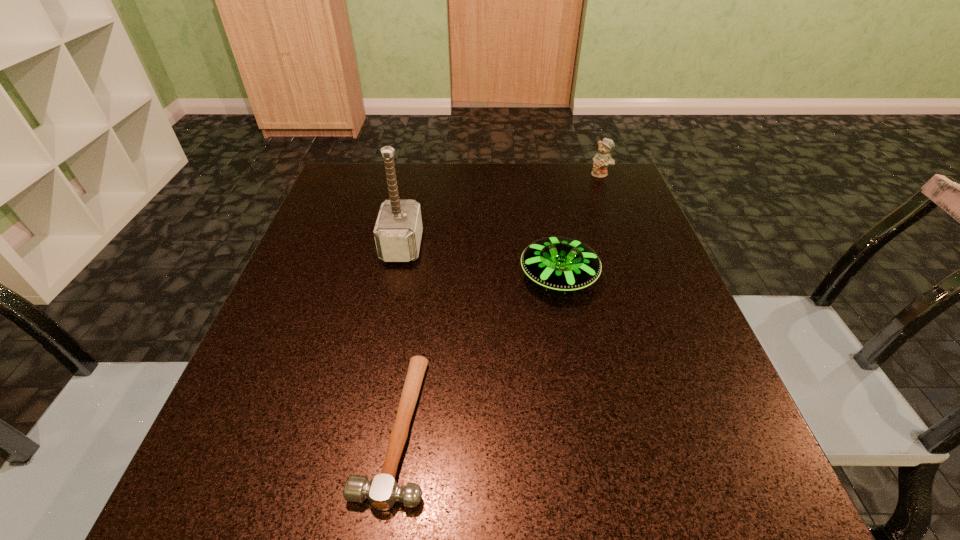
At what (x,y) coordinates should I click in order to perform the action: click on the tallest object. Please return your answer as a coordinate pair (x, y). This screenshot has height=540, width=960. Looking at the image, I should click on (398, 230).

Identify the location of the taller hammer. Image resolution: width=960 pixels, height=540 pixels. (398, 230).

Where is `the second tallest object`? the second tallest object is located at coordinates (601, 160).

Identify the location of the farthest object. (601, 160).

This screenshot has width=960, height=540. Find the location of `saucer`. saucer is located at coordinates (x=559, y=263).

The width and height of the screenshot is (960, 540). I want to click on the second object from right to left, so click(x=559, y=263).

This screenshot has height=540, width=960. I want to click on the nearest object, so click(382, 491).

Where is `the shortest object`? This screenshot has height=540, width=960. the shortest object is located at coordinates (382, 491).

You are a GUI agent. You are given a task and a screenshot of the screen. Output one action in this format:
    pyautogui.click(x=<x>, y=<y>)
    Task: Click on the vacant area located for striking with the head of the taller hammer
    
    Given the screenshot: What is the action you would take?
    pyautogui.click(x=550, y=246)

Locate an element on the screen. Image resolution: width=960 pixels, height=540 pixels. vacant space located 0.340m on the front-facing side of the teddy bear is located at coordinates (636, 263).